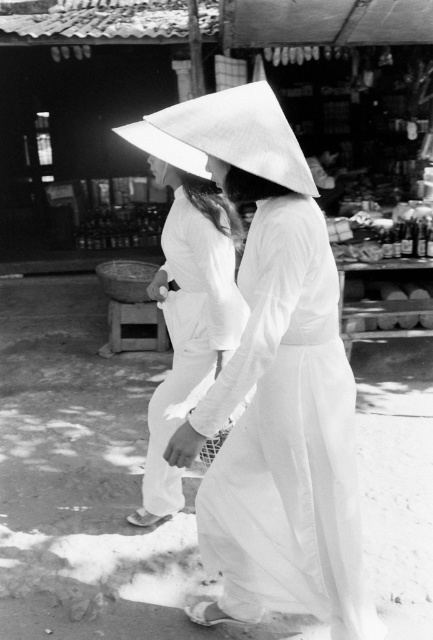
Question: Is white cotton dress at center thinner than white paper umbrella at center?

Choices:
 (A) no
 (B) yes

Answer: (B)

Question: Which is farther from the white paper umbrella at center?

Choices:
 (A) white matte ao dai at center
 (B) white cotton dress at center

Answer: (B)

Question: Which point is farther from the camera taking this photo?

Choices:
 (A) (338, 595)
 (B) (209, 96)

Answer: (A)

Question: Does white cotton dress at center have a lesser width compared to white paper umbrella at center?

Choices:
 (A) no
 (B) yes

Answer: (B)

Question: Which point is farther from the camera taking this photo?

Choices:
 (A) (190, 118)
 (B) (207, 356)

Answer: (B)

Question: Can you confirm if white cotton dress at center is wider than white paper umbrella at center?

Choices:
 (A) no
 (B) yes

Answer: (A)